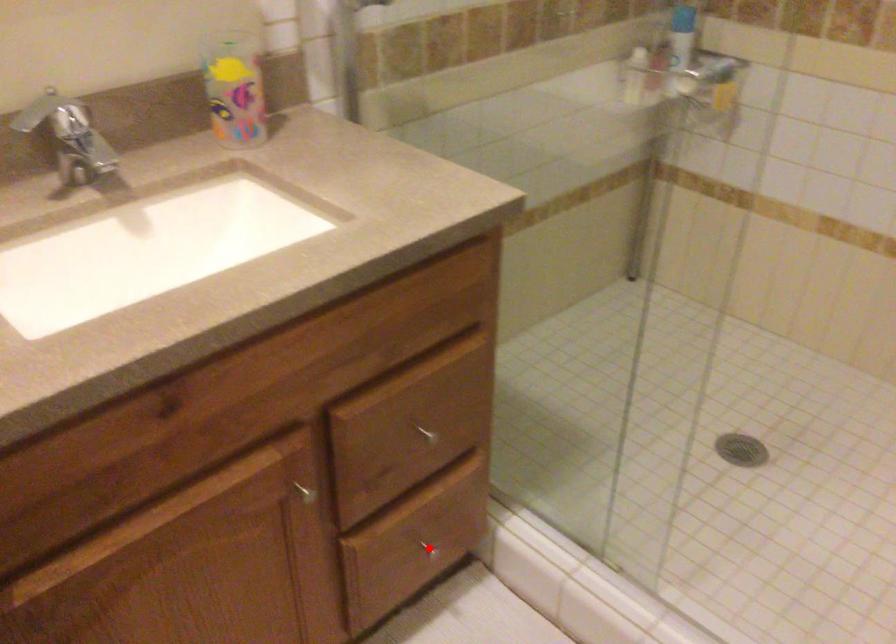
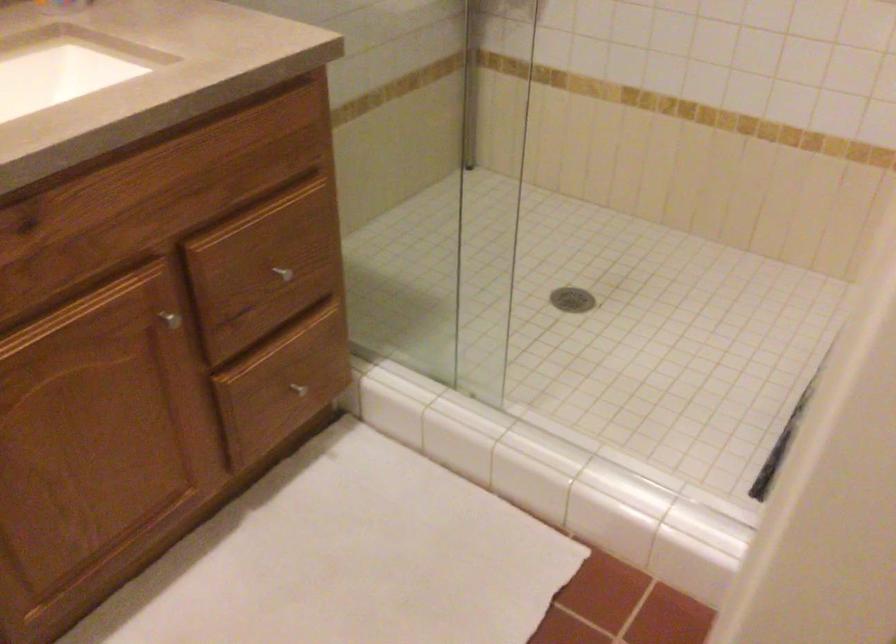
Where in the second image is the point corresponding to the highlighted location from the first image?

(297, 389)